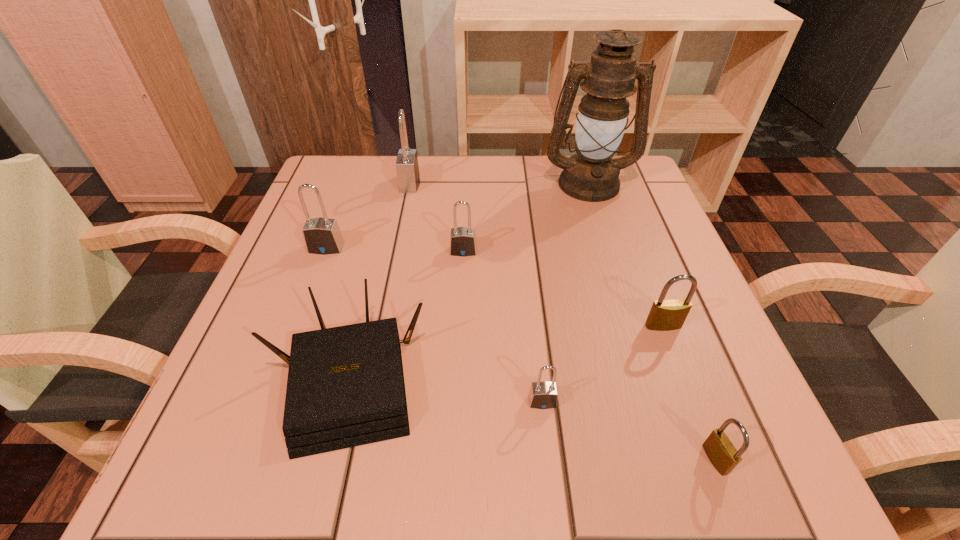
Locate an element on the screen. The image size is (960, 540). free spot located on the left of the nearer brass padlock is located at coordinates (459, 459).

Locate an element on the screen. The image size is (960, 540). oil lamp present at the far edge is located at coordinates (591, 175).

Identify the location of padlock that is at the far edge. (407, 167).

I want to click on router that is at the near edge, so click(x=345, y=388).

Locate an element on the screen. The width and height of the screenshot is (960, 540). padlock positioned at the near edge is located at coordinates (719, 449).

What are the coordinates of `padlock at the left edge` in the screenshot? It's located at (322, 236).

Find the location of a particular element. The height and width of the screenshot is (540, 960). router that is at the left edge is located at coordinates (345, 388).

Locate an element on the screen. The image size is (960, 540). oil lamp that is at the right edge is located at coordinates (591, 175).

This screenshot has width=960, height=540. Find the location of `object situated at the near left corner`. object situated at the near left corner is located at coordinates (x=345, y=388).

This screenshot has height=540, width=960. I want to click on object at the far right corner, so (591, 175).